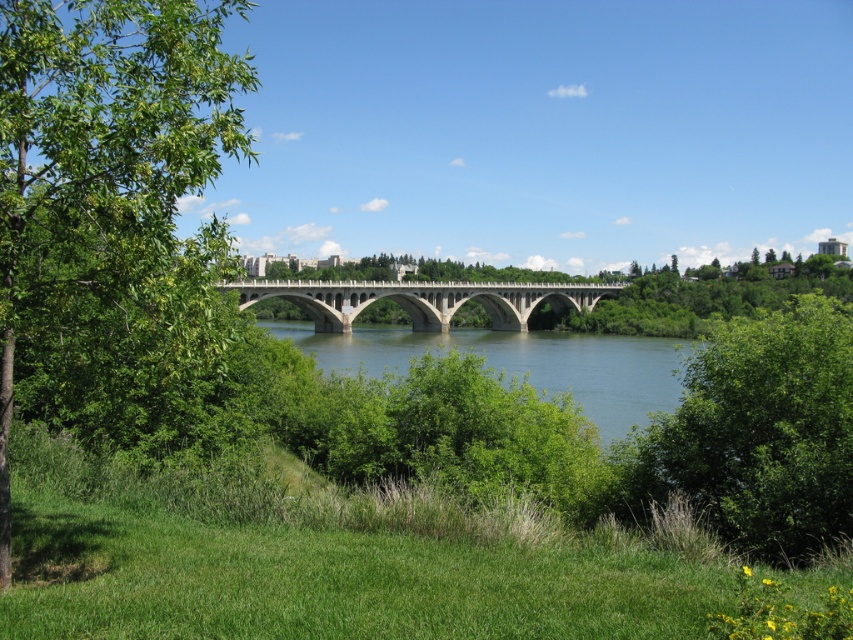
Question: Which point is closer to the camera?

Choices:
 (A) green leafy tree at left
 (B) blue concrete bridge at center
 (C) concrete bridge at center

Answer: (A)

Question: Estimate the real-world distances between objects in this image. Which object is closer to the green leafy bush at right?

Choices:
 (A) green leafy tree at left
 (B) blue concrete bridge at center

Answer: (A)

Question: Which point is farther to the camera?

Choices:
 (A) (61, 224)
 (B) (646, 355)
 (C) (509, 298)

Answer: (C)

Question: Can you confirm if green leafy tree at left is positioned below concrete bridge at center?

Choices:
 (A) yes
 (B) no

Answer: (B)

Question: Does green leafy bush at right appear on the right side of blue concrete bridge at center?

Choices:
 (A) yes
 (B) no

Answer: (A)

Question: Where is green leafy bush at right located in relation to blue concrete bridge at center in the image?

Choices:
 (A) left
 (B) right

Answer: (B)